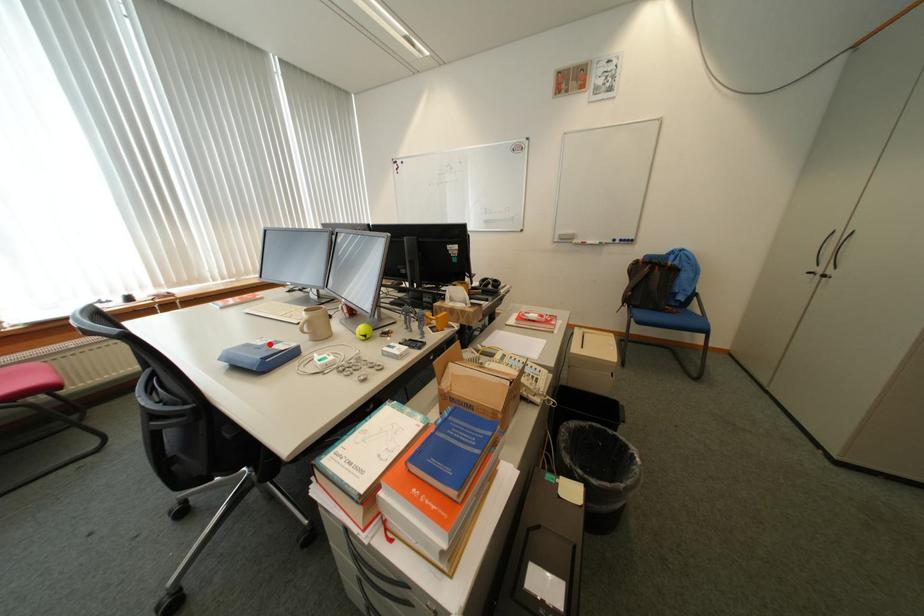
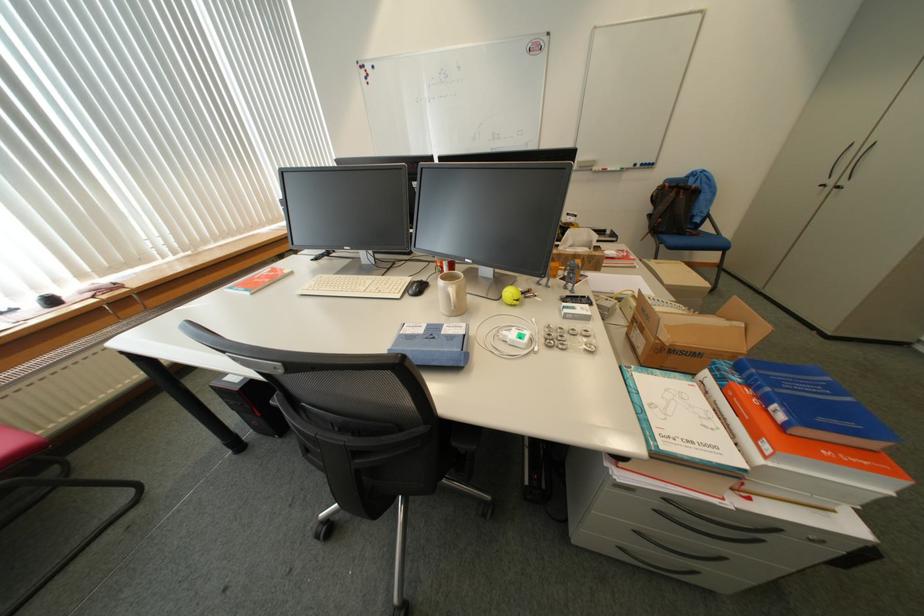
Find the pixel in the second image that matches the highlighted location in the first image.

(430, 331)